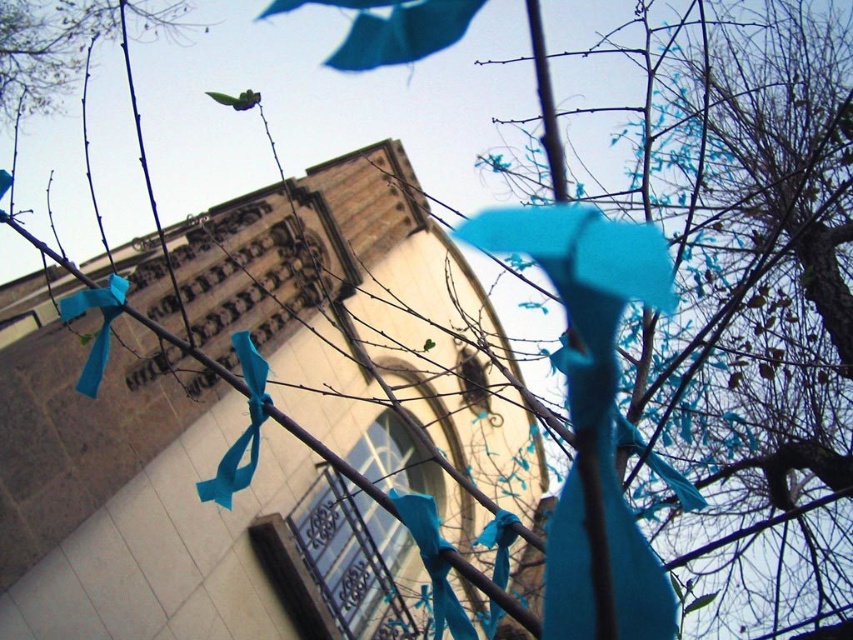
Question: Estimate the real-world distances between objects in this image. Which object is farther from the matte blue ribbon at center?

Choices:
 (A) teal fabric ribbon at center
 (B) matte blue ribbon at left

Answer: (A)

Question: Does teal fabric ribbon at center have a greater width compared to matte blue ribbon at center?

Choices:
 (A) no
 (B) yes

Answer: (B)

Question: Which object is positioned farthest from the teal fabric ribbon at center?

Choices:
 (A) matte blue ribbon at left
 (B) matte blue ribbon at center

Answer: (A)

Question: From the image, what is the correct spatial relationship of teal fabric ribbon at center in relation to matte blue ribbon at left?

Choices:
 (A) left
 (B) right

Answer: (B)

Question: Can you confirm if matte blue ribbon at center is positioned below matte blue ribbon at left?

Choices:
 (A) yes
 (B) no

Answer: (A)

Question: Which point is farther from the camera taking this photo?

Choices:
 (A) (99, 289)
 (B) (244, 481)
 (C) (466, 637)

Answer: (A)